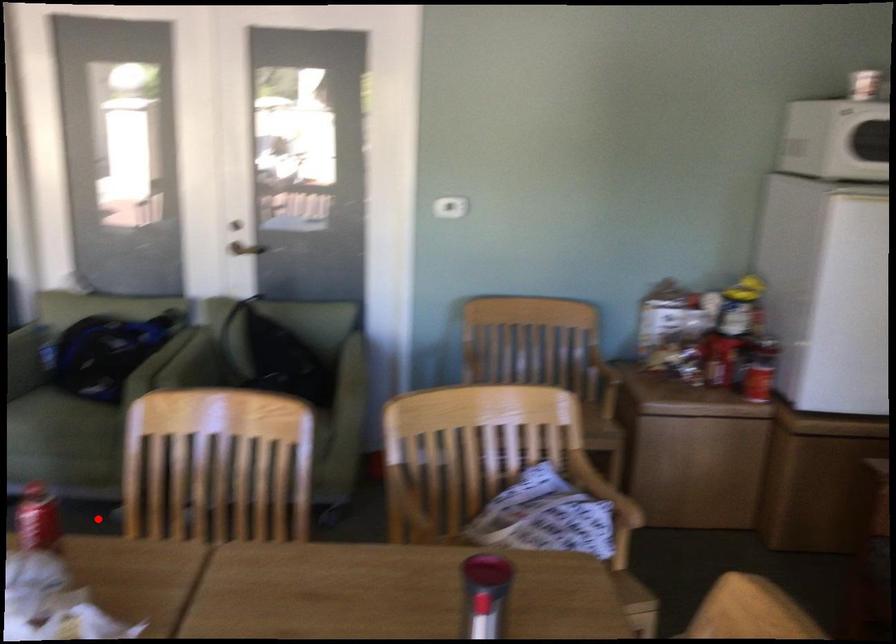
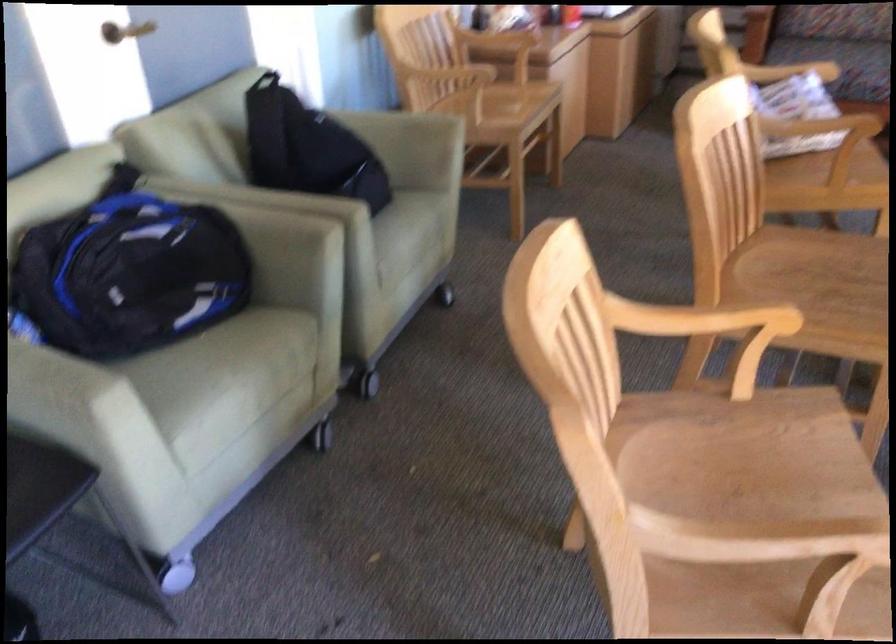
Question: I am providing you with two images of the same scene from different viewpoints. A red point is shown in image1. For the corresponding object point in image2, is it positioned nearer or farther from the camera?

Choices:
 (A) Nearer
 (B) Farther

Answer: (A)